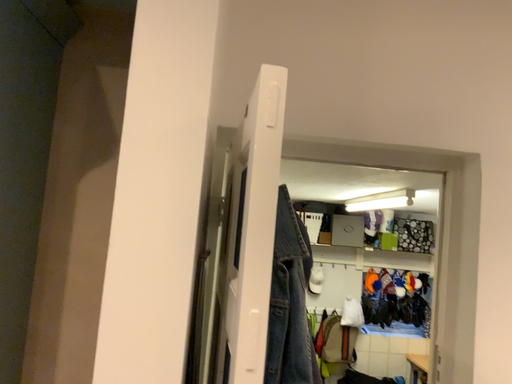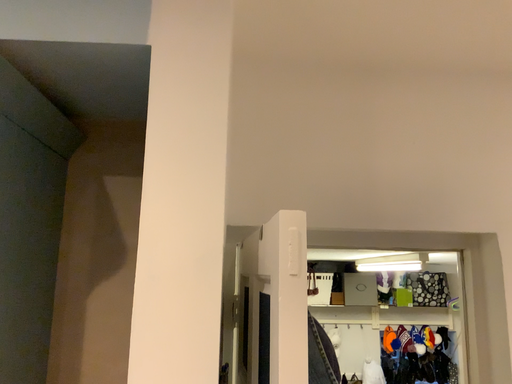
Question: Which way did the camera rotate in the video?

Choices:
 (A) rotated downward
 (B) rotated upward

Answer: (B)